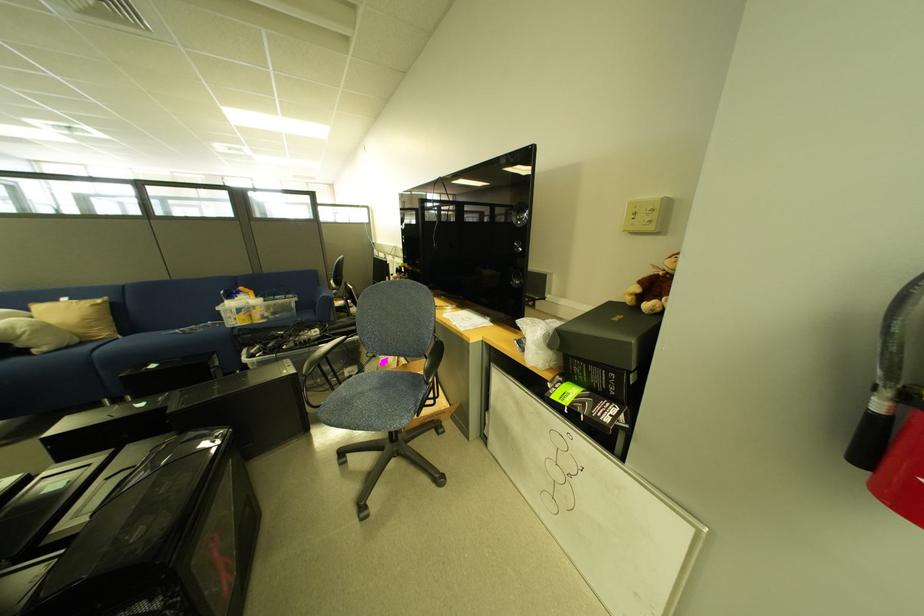
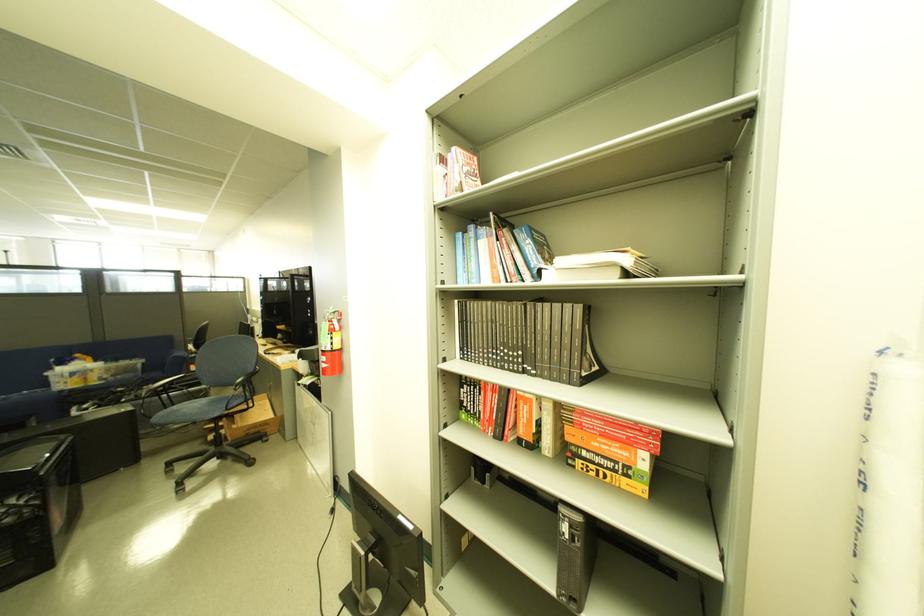
Question: I am providing you with two images of the same scene from different viewpoints. Which of the following objects are not visible in image2?

Choices:
 (A) chair armrest
 (B) black electric kettle
 (C) brown stuffed animal
 (D) red paperback book

Answer: (C)